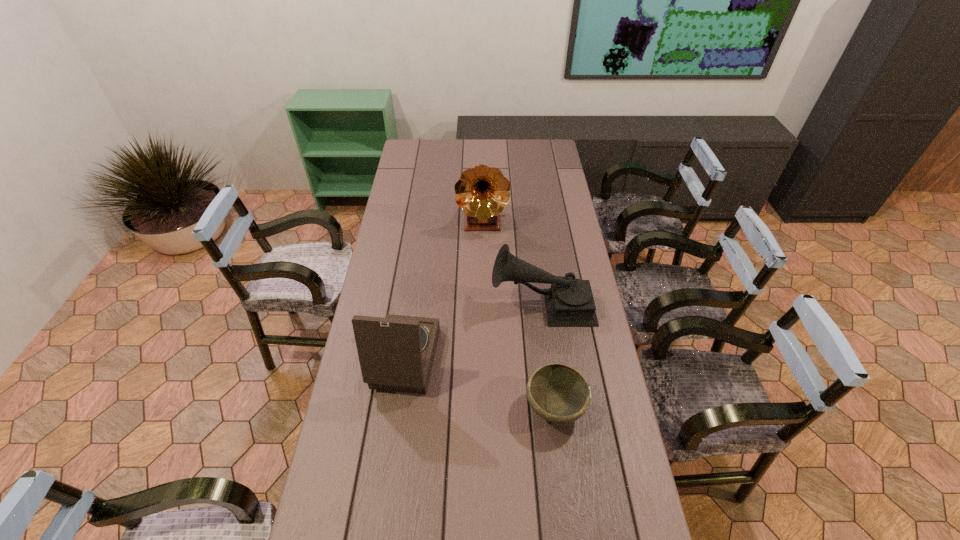
Where is `the farthest phonograph_record`? the farthest phonograph_record is located at coordinates (482, 192).

Where is `the leftmost object`? The width and height of the screenshot is (960, 540). the leftmost object is located at coordinates (396, 353).

The height and width of the screenshot is (540, 960). I want to click on the third tallest object, so click(x=569, y=302).

The width and height of the screenshot is (960, 540). Find the location of `the shortest object`. the shortest object is located at coordinates (558, 393).

Locate an element on the screen. vacant position located on the horn of the farthest object is located at coordinates (483, 255).

Find the location of `free point located 0.350m on the front of the leftmost object`. free point located 0.350m on the front of the leftmost object is located at coordinates (371, 534).

Locate an element on the screen. vacant space located 0.150m from the horn of the third tallest object is located at coordinates (448, 304).

Where is `free space located from the horn of the third tallest object`? free space located from the horn of the third tallest object is located at coordinates (417, 304).

At what (x,y) coordinates should I click in order to perform the action: click on free space located 0.070m from the horn of the third tallest object. Please return your answer as a coordinate pair (x, y). The height and width of the screenshot is (540, 960). Looking at the image, I should click on click(471, 304).

At what (x,y) coordinates should I click in order to perform the action: click on vacant area situated 0.350m on the back of the shortest object. Please return your answer as a coordinate pair (x, y). The image size is (960, 540). Looking at the image, I should click on [540, 294].